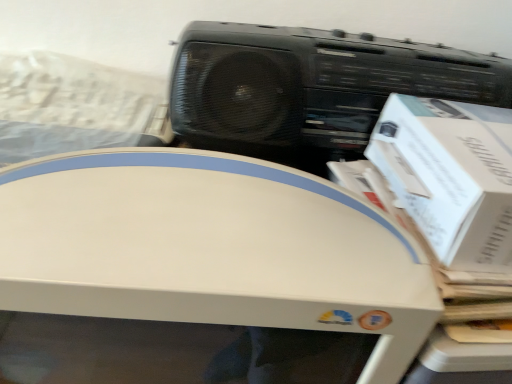
The height and width of the screenshot is (384, 512). Find the location of `free space above white plastic printer at center (from a real-world perspective)`. free space above white plastic printer at center (from a real-world perspective) is located at coordinates (190, 198).